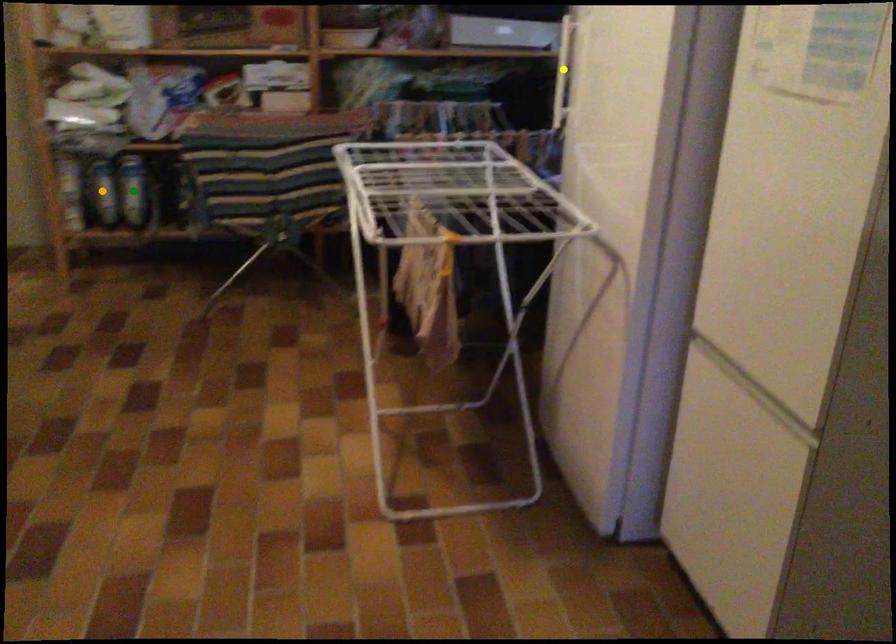
Order these from farthest to nearest:
- green point
- orange point
- yellow point

orange point, green point, yellow point